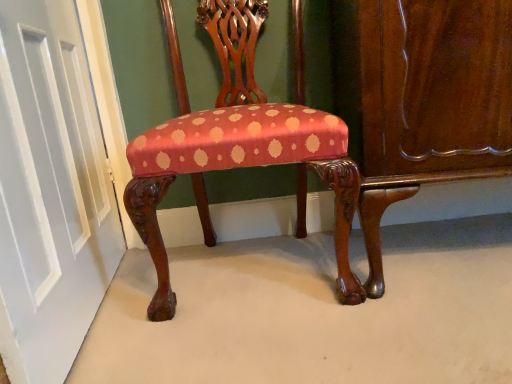
Where is `vacant location below glossy wood dresser at lower right (from a real-world perspective)`? The height and width of the screenshot is (384, 512). vacant location below glossy wood dresser at lower right (from a real-world perspective) is located at coordinates (438, 254).